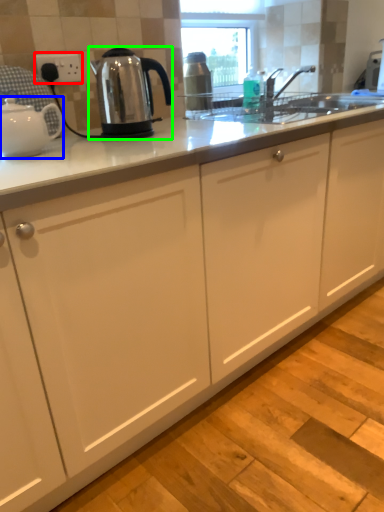
Question: Based on their relative distances, which object is nearer to electric outlet (highlighted by a red box)? Choose from kettle (highlighted by a blue box) and kettle (highlighted by a green box).

Choices:
 (A) kettle
 (B) kettle

Answer: (B)